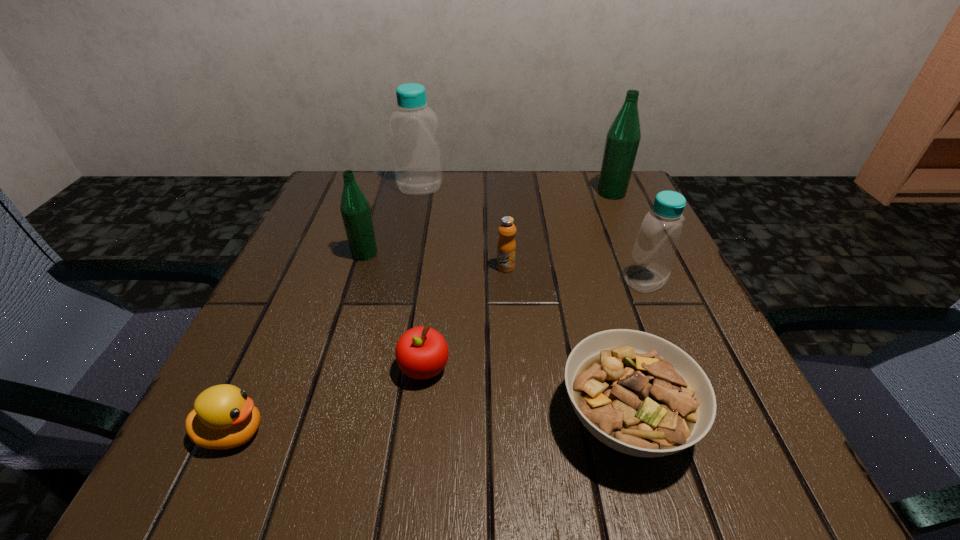
The width and height of the screenshot is (960, 540). In order to click on free space that satisfies the following two spatial constraints: 1. on the front side of the stew; 2. on the right side of the farther blue bottle in this screenshot , I will do `click(373, 418)`.

Image resolution: width=960 pixels, height=540 pixels. What are the coordinates of `vacant position in the image that satisfies the following two spatial constraints: 1. on the front label of the fifth tallest object; 2. on the right side of the nearer blue bottle` in the screenshot? It's located at (507, 280).